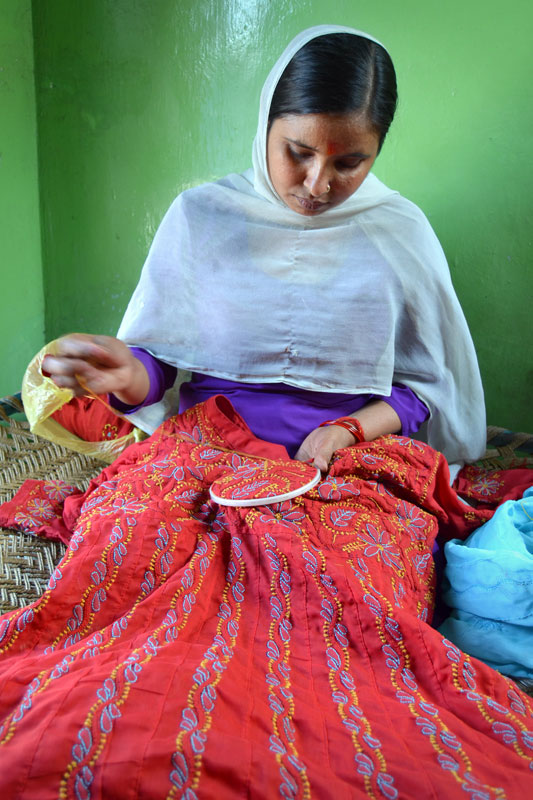
Locate an element on the screen. wall is located at coordinates (125, 217).